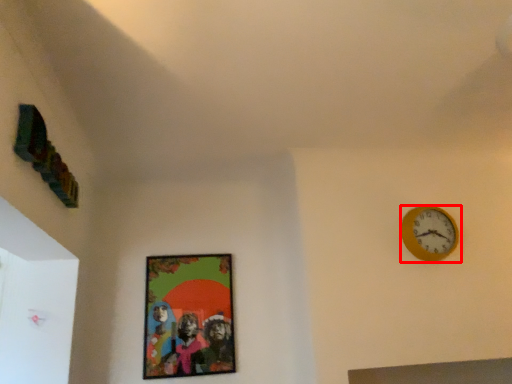
Question: In this image, where is wall clock (annotated by the red box) located relative to picture frame?

Choices:
 (A) right
 (B) left

Answer: (A)